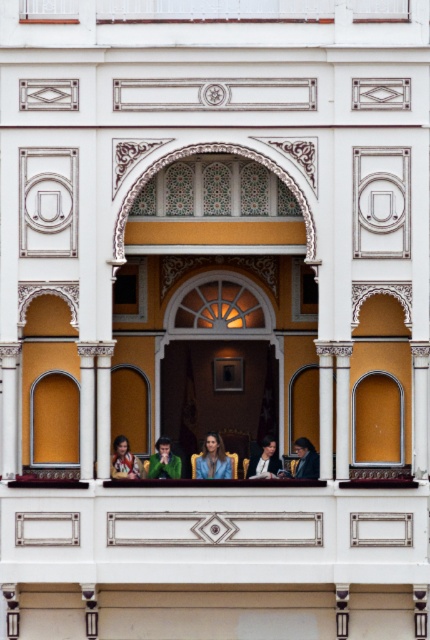
Question: Which object is closer to the camera taking this photo?

Choices:
 (A) smooth blue shirt at center
 (B) transparent glass window at center

Answer: (B)

Question: Observing the image, what is the correct spatial positioning of clear glass window at upper left in reference to transparent glass window at center?

Choices:
 (A) below
 (B) above

Answer: (B)

Question: Is matte black jacket at center below dark blue suit at lower right?

Choices:
 (A) no
 (B) yes

Answer: (A)

Question: Which of the following is the farthest from the observer?

Choices:
 (A) clear glass window at upper left
 (B) smooth blue shirt at center
 (C) matte black jacket at center

Answer: (B)

Question: Is transparent glass window at center above dark blue suit at lower right?

Choices:
 (A) no
 (B) yes

Answer: (B)

Question: Which object is the farthest from the green velvet chair at center?

Choices:
 (A) transparent glass window at center
 (B) dark blue suit at lower right
 (C) matte black suit at center
 (D) clear glass window at upper left

Answer: (A)